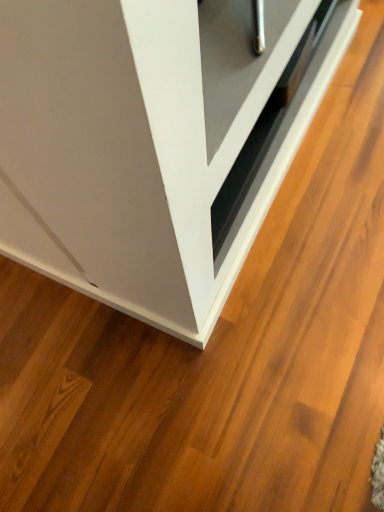
Question: In terms of width, does matte black drawer at center look wider or thinner when compared to white glossy cabinet at lower right?

Choices:
 (A) thin
 (B) wide

Answer: (A)

Question: From the image's perspective, relative to white glossy cabinet at lower right, is matte black drawer at center above or below?

Choices:
 (A) below
 (B) above

Answer: (B)

Question: Considering the positions of matte black drawer at center and white glossy cabinet at lower right in the image, is matte black drawer at center taller or shorter than white glossy cabinet at lower right?

Choices:
 (A) short
 (B) tall

Answer: (A)

Question: From a real-world perspective, is white glossy cabinet at lower right positioned above or below matte black drawer at center?

Choices:
 (A) above
 (B) below

Answer: (B)

Question: Does point (198, 92) appear closer or farther from the camera than point (271, 159)?

Choices:
 (A) farther
 (B) closer

Answer: (B)

Question: Considering their positions, is white glossy cabinet at lower right located in front of or behind matte black drawer at center?

Choices:
 (A) front
 (B) behind

Answer: (A)

Question: Based on their positions, is white glossy cabinet at lower right located to the left or right of matte black drawer at center?

Choices:
 (A) right
 (B) left

Answer: (B)